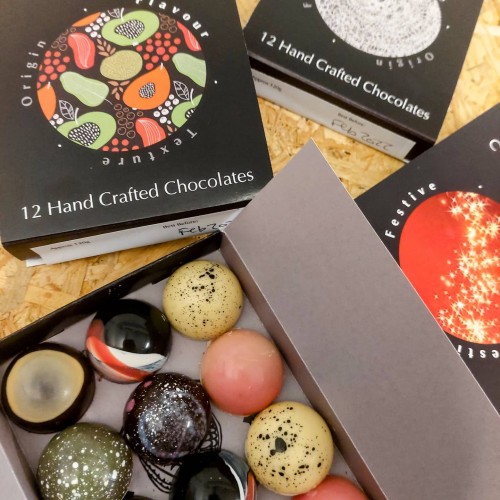
At what (x,y) coordinates should I click in order to perform the action: click on countertop. Please return your answer as a coordinate pair (x, y). The height and width of the screenshot is (500, 500). Looking at the image, I should click on (287, 132).